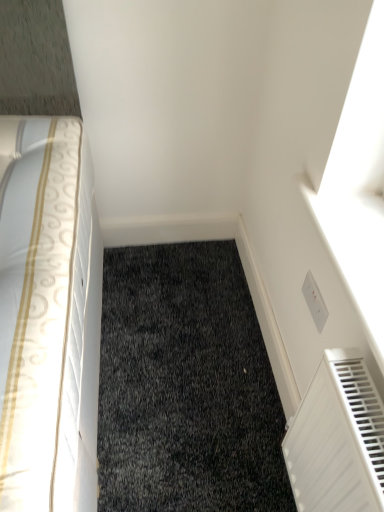
Locate an element on the screen. dark gray carpet at center is located at coordinates (186, 386).

What do you see at coordinates (186, 386) in the screenshot? The width and height of the screenshot is (384, 512). I see `dark gray carpet at center` at bounding box center [186, 386].

What is the approximate width of dark gray carpet at center?

dark gray carpet at center is 1.08 meters in width.

Where is `dark gray carpet at center`? The width and height of the screenshot is (384, 512). dark gray carpet at center is located at coordinates (186, 386).